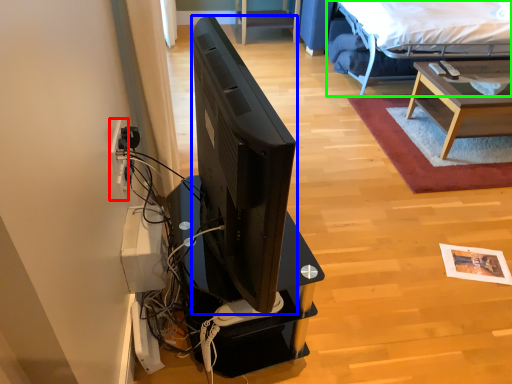
Question: Based on their relative distances, which object is farther from electric outlet (highlighted by a red box)? Choose from television (highlighted by a blue box) and bed (highlighted by a green box).

Choices:
 (A) television
 (B) bed

Answer: (B)